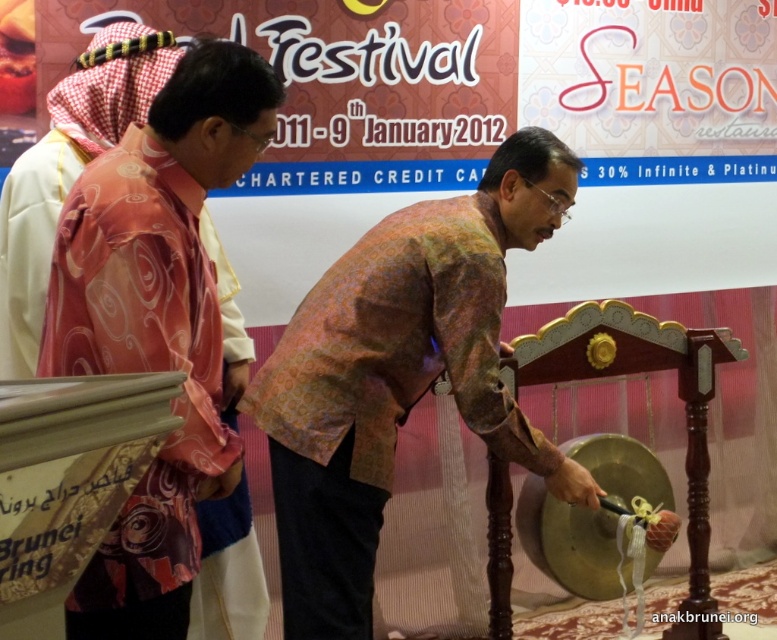
Is multicolored batik shirt at center above pink satin robe at left?

Result: Actually, multicolored batik shirt at center is below pink satin robe at left.

Can you confirm if multicolored batik shirt at center is thinner than pink satin robe at left?

No, multicolored batik shirt at center is not thinner than pink satin robe at left.

Is point (497, 323) positioned before point (120, 243)?

No, (497, 323) is further to viewer.

The image size is (777, 640). I want to click on multicolored batik shirt at center, so click(x=399, y=374).